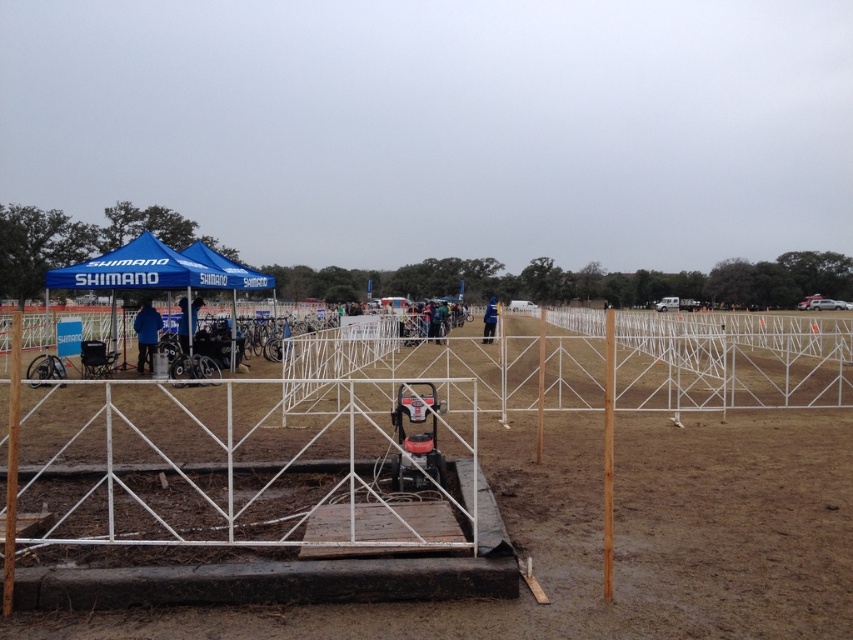
Does red plastic generator at center appear over blue fabric tent at left?

No, red plastic generator at center is not above blue fabric tent at left.

Between red plastic generator at center and blue fabric tent at left, which one is positioned higher?

blue fabric tent at left is above.

The height and width of the screenshot is (640, 853). Find the location of `red plastic generator at center`. red plastic generator at center is located at coordinates pyautogui.click(x=416, y=438).

This screenshot has width=853, height=640. I want to click on red plastic generator at center, so click(x=416, y=438).

Image resolution: width=853 pixels, height=640 pixels. What do you see at coordinates (138, 269) in the screenshot?
I see `blue fabric canopy at left` at bounding box center [138, 269].

Between point (137, 289) and point (186, 252), which one is positioned in front?

Point (137, 289)

Locate an element on the screen. The image size is (853, 640). blue fabric canopy at left is located at coordinates (138, 269).

Can you confirm if brown dirt field at center is thinner than blue fabric jacket at center?

No.

What do you see at coordinates (618, 540) in the screenshot? The height and width of the screenshot is (640, 853). I see `brown dirt field at center` at bounding box center [618, 540].

Image resolution: width=853 pixels, height=640 pixels. Describe the element at coordinates (618, 540) in the screenshot. I see `brown dirt field at center` at that location.

This screenshot has height=640, width=853. In order to click on brown dirt field at center in this screenshot , I will do `click(618, 540)`.